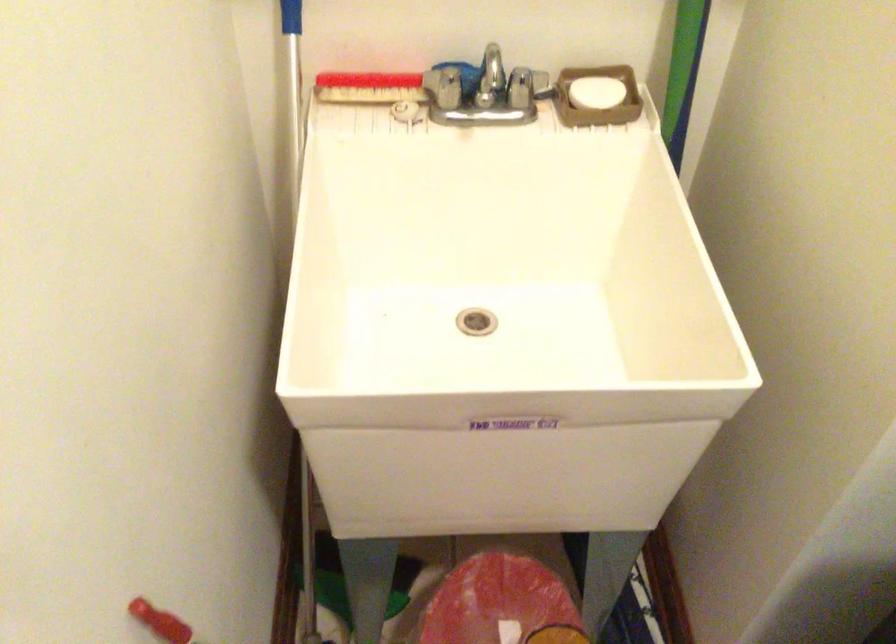
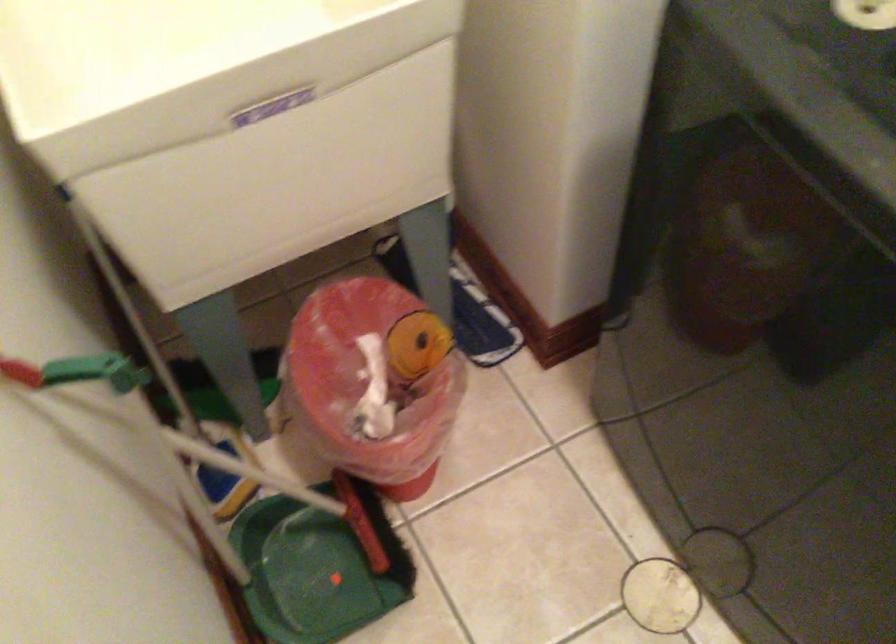
Question: What movement of the cameraman would produce the second image?

Choices:
 (A) Left
 (B) Right
 (C) Forward
 (D) Backward

Answer: (D)